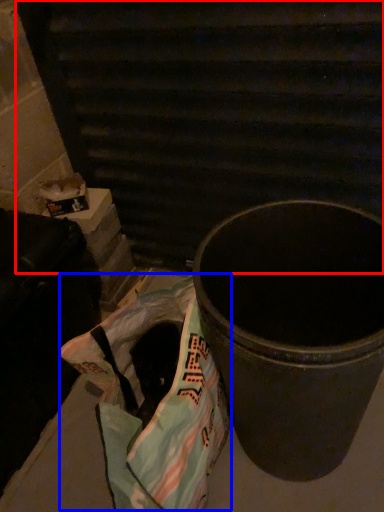
Question: Which of the following is the closest to the observer, stairwell (highlighted by a red box) or grocery bag (highlighted by a blue box)?

Choices:
 (A) stairwell
 (B) grocery bag

Answer: (B)